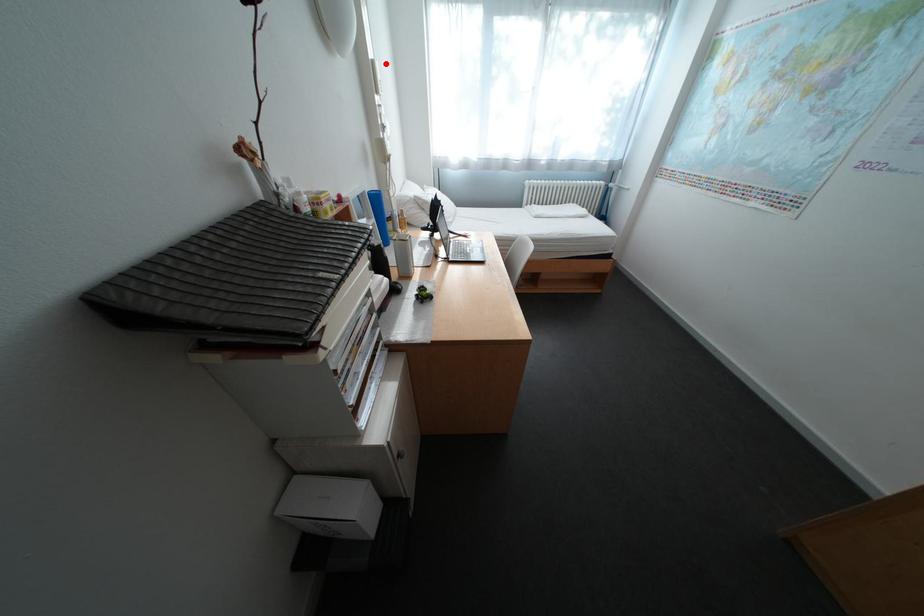
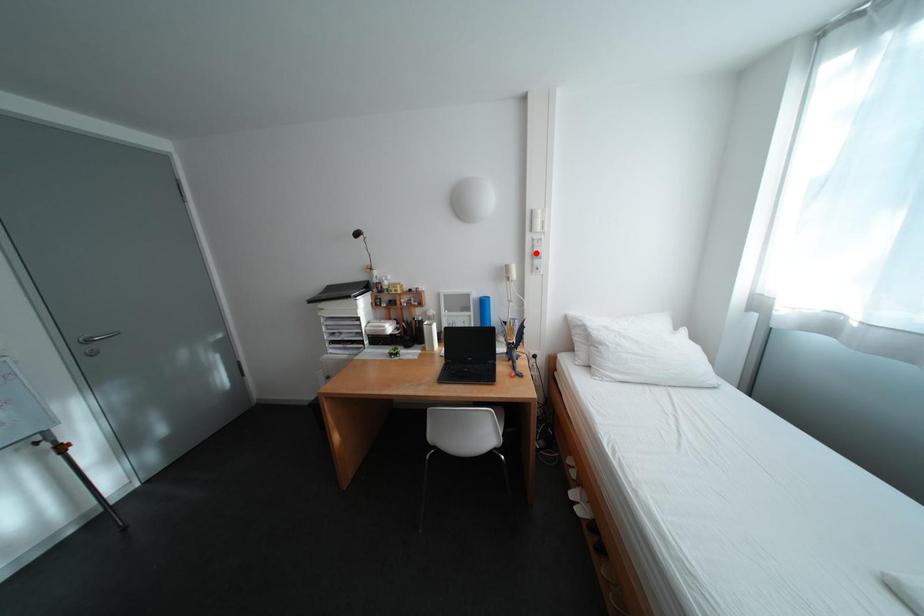
I am providing you with two images of the same scene from different viewpoints. A red point is marked on the first image and another point is marked on the second image. Is the red point in image1 aligned with the point shown in image2?

No